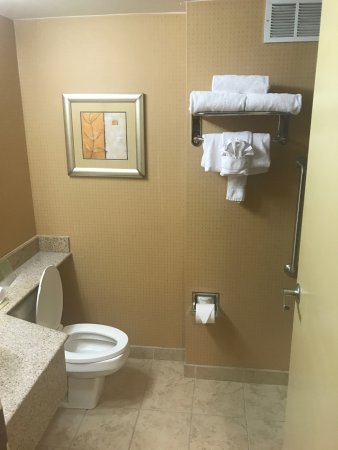
At what (x,y) coordinates should I click in order to perform the action: click on door handle. Please return your answer as a coordinate pair (x, y). The image size is (338, 450). Looking at the image, I should click on (284, 300), (289, 290), (297, 286), (297, 297).